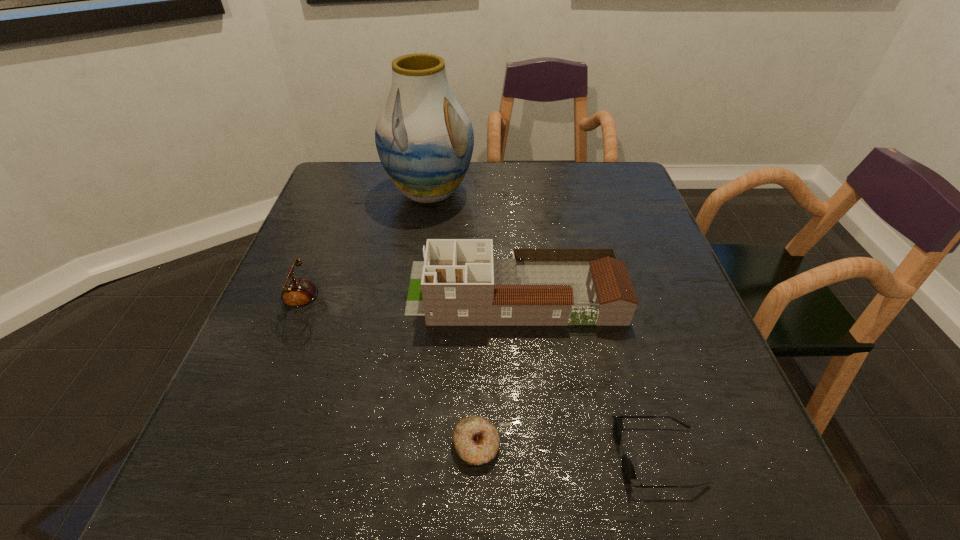
Where is `free space located 0.050m at the main entrance of the dollhouse`? This screenshot has width=960, height=540. free space located 0.050m at the main entrance of the dollhouse is located at coordinates (386, 292).

You are a GUI agent. You are given a task and a screenshot of the screen. Output one action in this format:
    pyautogui.click(x=<x>, y=<y>)
    Task: Click on the vacant space located 0.390m on the rotary dial of the leftmost object
    The height and width of the screenshot is (540, 960).
    Given the screenshot: What is the action you would take?
    point(507,311)

The height and width of the screenshot is (540, 960). In order to click on free space located 0.300m on the front-facing side of the sunglasses in this screenshot , I will do `click(434, 456)`.

At what (x,y) coordinates should I click in order to perform the action: click on free space located on the front-facing side of the sunglasses. Please return your answer as a coordinate pair (x, y). The width and height of the screenshot is (960, 540). Looking at the image, I should click on (494, 456).

What are the coordinates of `vacant region located 0.190m on the front-facing side of the sunglasses` in the screenshot? It's located at (501, 456).

Image resolution: width=960 pixels, height=540 pixels. I want to click on vacant area located 0.310m on the back of the doughnut, so coord(477,293).

Where is `object located at the far edge`? object located at the far edge is located at coordinates (424, 138).

Locate an element on the screen. This screenshot has height=540, width=960. sunglasses positioned at the near edge is located at coordinates (628, 470).

Locate an element on the screen. This screenshot has width=960, height=540. doughnut that is positioned at the near edge is located at coordinates (476, 440).

Find the location of a particular element. object present at the left edge is located at coordinates (297, 293).